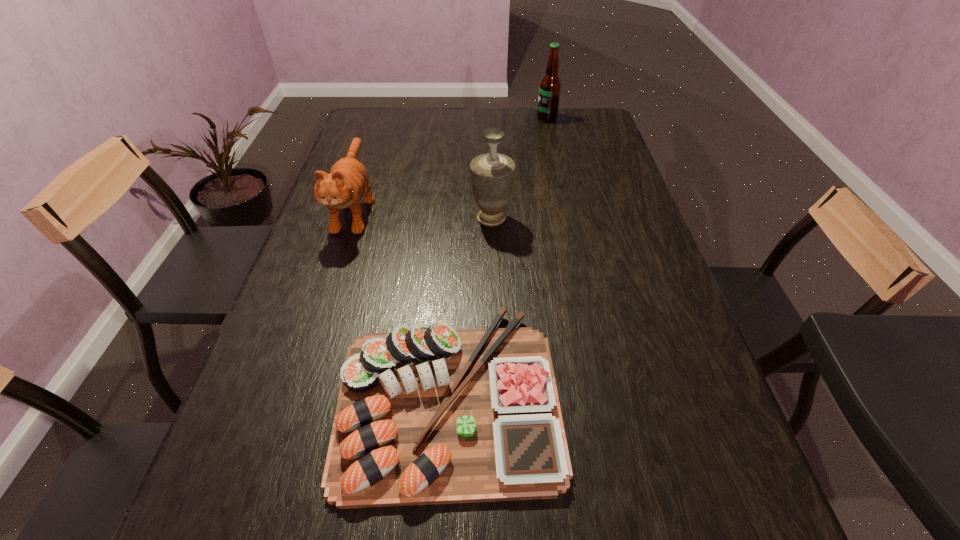
You are a GUI agent. You are given a task and a screenshot of the screen. Output one action in this format:
    pyautogui.click(x=<x>, y=<y>)
    Task: Click on the object that stands as the closest to the farthest object
    The image size is (960, 540).
    Given the screenshot: What is the action you would take?
    pyautogui.click(x=492, y=174)

Locate which object ranks second in proximity to the urn. Please provide its 2D coordinates. Your answer should be formatted as a tuple, i.e. [(x, y)], where the tuple contains the x and y coordinates of a point satisfying the conditions above.

[(426, 415)]

The height and width of the screenshot is (540, 960). Identify the location of vacant region that satisfies the following two spatial constraints: 1. on the face of the urn; 2. on the left side of the cat. (351, 218).

Where is `vacant space that satisfies the following two spatial constraints: 1. on the face of the cat; 2. on the right side of the urn`? vacant space that satisfies the following two spatial constraints: 1. on the face of the cat; 2. on the right side of the urn is located at coordinates (351, 218).

The height and width of the screenshot is (540, 960). In order to click on free spot that satisfies the following two spatial constraints: 1. on the face of the urn; 2. on the left side of the second shortest object in this screenshot , I will do `click(351, 218)`.